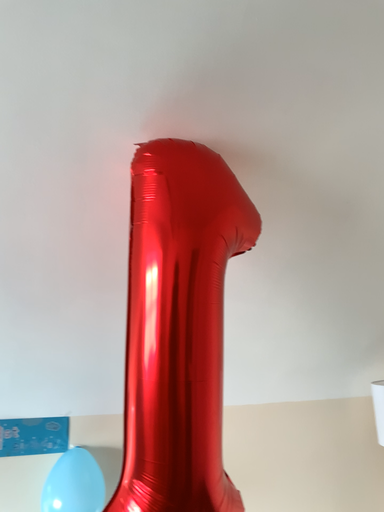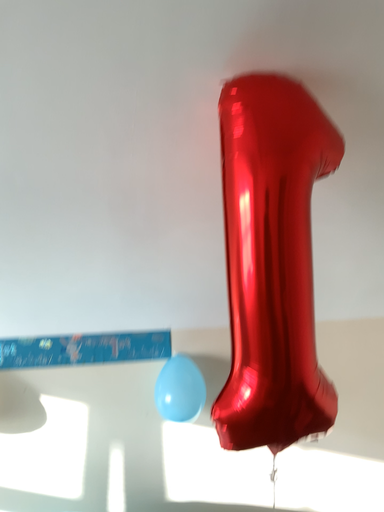
Question: Which way did the camera rotate in the video?

Choices:
 (A) rotated right
 (B) rotated left

Answer: (B)